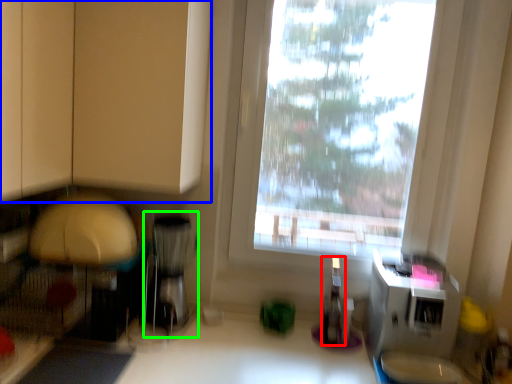
Question: Which object is the closest to the bottle (highlighted by a red box)? Choose among these: cabinetry (highlighted by a blue box) or appliance (highlighted by a green box).

Choices:
 (A) cabinetry
 (B) appliance

Answer: (B)